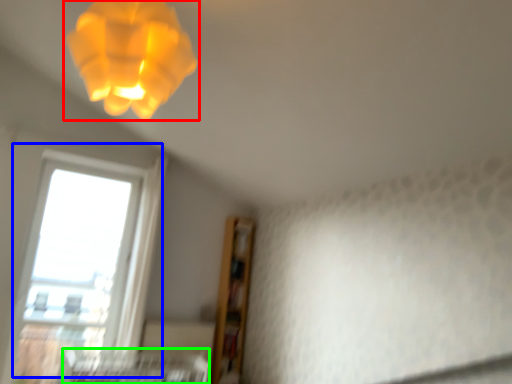
Question: Considering the real-world distances, which object is farthest from lamp (highlighted by a red box)? window (highlighted by a blue box) or bed frame (highlighted by a green box)?

Choices:
 (A) window
 (B) bed frame

Answer: (B)